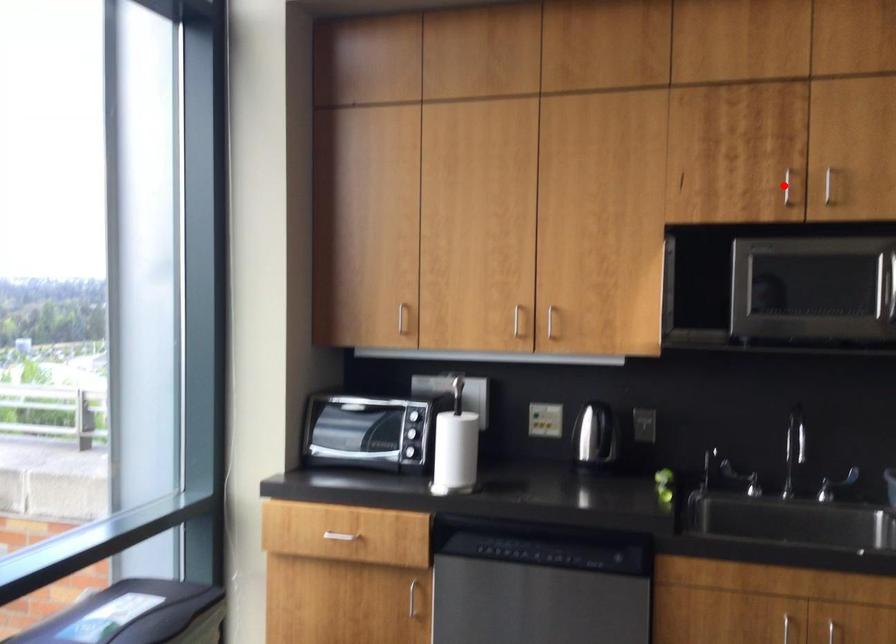
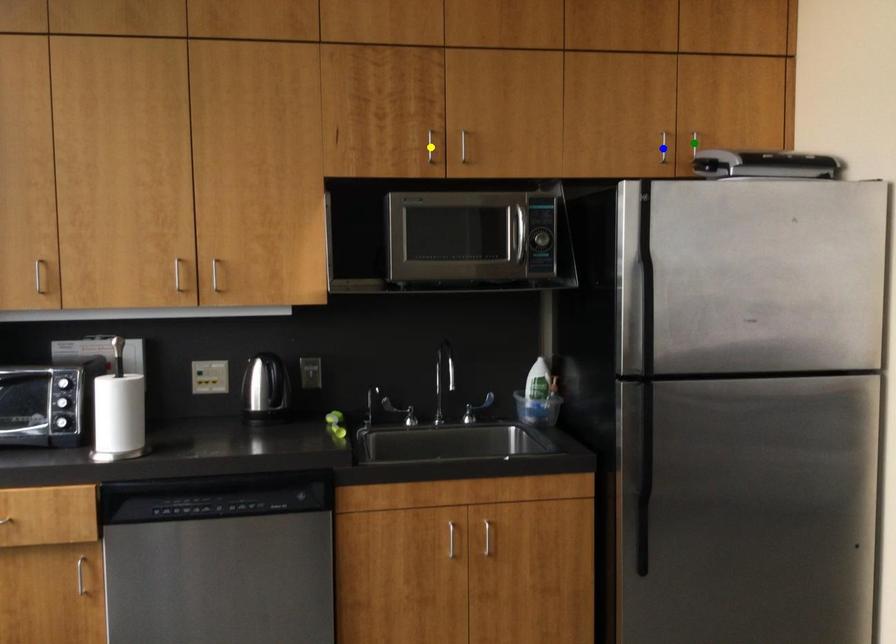
Question: I am providing you with two images of the same scene from different viewpoints. A red point is marked on the first image. You are given multiple points on the second image. Which point in image 2 represents the same 3d spot as the red point in image 1?

Choices:
 (A) green point
 (B) yellow point
 (C) blue point

Answer: (B)